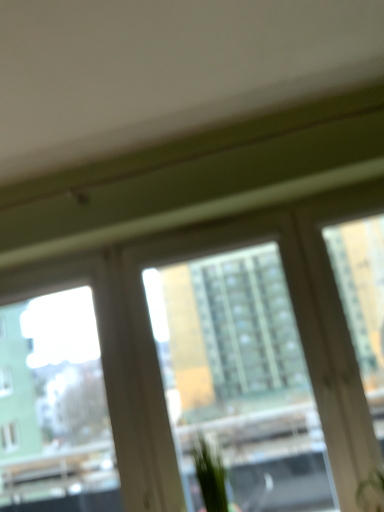
The width and height of the screenshot is (384, 512). I want to click on green leafy plant at center, the 2th plant when ordered from right to left, so click(210, 474).

Describe the element at coordinates (371, 492) in the screenshot. I see `green matte plant at lower right, placed as the first plant when sorted from right to left` at that location.

I want to click on green matte plant at lower right, arranged as the 2th plant when viewed from the left, so click(371, 492).

You are a GUI agent. You are given a task and a screenshot of the screen. Output one action in this format:
    pyautogui.click(x=<x>, y=<y>)
    Task: Click on the transparent glass window screen at left
    
    Given the screenshot: What is the action you would take?
    pyautogui.click(x=54, y=408)

The width and height of the screenshot is (384, 512). What are the coordinates of `green leafy plant at center, which is the 1th plant from left to right` in the screenshot? It's located at (210, 474).

Is transparent glass window at center positioned beyond the bounds of green leafy plant at center, the 2th plant when ordered from right to left?

Yes, transparent glass window at center is located beyond the bounds of green leafy plant at center, the 2th plant when ordered from right to left.

Which object is positioned more to the right, transparent glass window at center or green leafy plant at center, the 2th plant when ordered from right to left?

From the viewer's perspective, transparent glass window at center appears more on the right side.

From a real-world perspective, relative to green leafy plant at center, which is the 1th plant from left to right, is transparent glass window at center vertically above or below?

From a real-world perspective, transparent glass window at center is physically above green leafy plant at center, which is the 1th plant from left to right.

Looking at this image, from the image's perspective, who appears lower, transparent glass window at center or green leafy plant at center, which is the 1th plant from left to right?

green leafy plant at center, which is the 1th plant from left to right.

Who is taller, transparent glass window at center or transparent glass window screen at left?

transparent glass window at center.

Based on their positions, is transparent glass window at center located to the left or right of transparent glass window screen at left?

Based on their positions, transparent glass window at center is located to the right of transparent glass window screen at left.

Is transparent glass window at center not near transparent glass window screen at left?

No.

Measure the distance between transparent glass window at center and green matte plant at lower right, arranged as the 2th plant when viewed from the left.

A distance of 28.67 inches exists between transparent glass window at center and green matte plant at lower right, arranged as the 2th plant when viewed from the left.

Between point (164, 236) and point (383, 474), which one is positioned behind?

The point (164, 236) is more distant.

Based on the photo, is transparent glass window at center spatially inside green matte plant at lower right, placed as the first plant when sorted from right to left, or outside of it?

transparent glass window at center is not inside green matte plant at lower right, placed as the first plant when sorted from right to left, it's outside.

Is transparent glass window at center in contact with green matte plant at lower right, arranged as the 2th plant when viewed from the left?

transparent glass window at center and green matte plant at lower right, arranged as the 2th plant when viewed from the left, are clearly separated.

Is green leafy plant at center, which is the 1th plant from left to right, to the left or to the right of transparent glass window screen at left in the image?

In the image, green leafy plant at center, which is the 1th plant from left to right, appears on the right side of transparent glass window screen at left.

Is green leafy plant at center, which is the 1th plant from left to right, positioned far away from transparent glass window screen at left?

Actually, green leafy plant at center, which is the 1th plant from left to right, and transparent glass window screen at left are a little close together.

Is green leafy plant at center, which is the 1th plant from left to right, oriented towards transparent glass window screen at left?

No, green leafy plant at center, which is the 1th plant from left to right, does not turn towards transparent glass window screen at left.

Based on their sizes in the image, would you say green leafy plant at center, the 2th plant when ordered from right to left, is bigger or smaller than transparent glass window screen at left?

In the image, green leafy plant at center, the 2th plant when ordered from right to left, appears to be smaller than transparent glass window screen at left.

From a real-world perspective, between green matte plant at lower right, arranged as the 2th plant when viewed from the left, and green leafy plant at center, which is the 1th plant from left to right, who is vertically lower?

green matte plant at lower right, arranged as the 2th plant when viewed from the left.

Is green matte plant at lower right, arranged as the 2th plant when viewed from the left, next to green leafy plant at center, the 2th plant when ordered from right to left?

They are not placed beside each other.

Considering the relative positions of green matte plant at lower right, placed as the first plant when sorted from right to left, and green leafy plant at center, the 2th plant when ordered from right to left, in the image provided, is green matte plant at lower right, placed as the first plant when sorted from right to left, to the left or to the right of green leafy plant at center, the 2th plant when ordered from right to left,?

green matte plant at lower right, placed as the first plant when sorted from right to left, is positioned on green leafy plant at center, the 2th plant when ordered from right to left,'s right side.

In terms of height, does green matte plant at lower right, placed as the first plant when sorted from right to left, look taller or shorter compared to green leafy plant at center, the 2th plant when ordered from right to left?

green matte plant at lower right, placed as the first plant when sorted from right to left, is shorter than green leafy plant at center, the 2th plant when ordered from right to left.

The width and height of the screenshot is (384, 512). I want to click on window that appears on the right of green leafy plant at center, the 2th plant when ordered from right to left, so click(154, 346).

Does green leafy plant at center, the 2th plant when ordered from right to left, come in front of transparent glass window at center?

No, it is not.

From a real-world perspective, between green leafy plant at center, which is the 1th plant from left to right, and transparent glass window at center, who is vertically higher?

transparent glass window at center.

Considering the positions of points (211, 509) and (323, 345), is point (211, 509) farther from camera compared to point (323, 345)?

No, (211, 509) is closer to viewer.

Which point is more distant from viewer, (372,499) or (21,447)?

The point (21,447) is farther.

Which of these two, green matte plant at lower right, arranged as the 2th plant when viewed from the left, or transparent glass window screen at left, stands shorter?

Standing shorter between the two is green matte plant at lower right, arranged as the 2th plant when viewed from the left.

Would you say green matte plant at lower right, arranged as the 2th plant when viewed from the left, is to the left or to the right of transparent glass window screen at left in the picture?

In the image, green matte plant at lower right, arranged as the 2th plant when viewed from the left, appears on the right side of transparent glass window screen at left.

From a real-world perspective, is green matte plant at lower right, arranged as the 2th plant when viewed from the left, over transparent glass window screen at left?

No, from a real-world perspective, green matte plant at lower right, arranged as the 2th plant when viewed from the left, is not above transparent glass window screen at left.

At what (x,y) coordinates should I click in order to perform the action: click on plant located on the left of transparent glass window at center. Please return your answer as a coordinate pair (x, y). Image resolution: width=384 pixels, height=512 pixels. Looking at the image, I should click on (210, 474).

Locate an element on the screen. This screenshot has width=384, height=512. window that appears on the right of transparent glass window screen at left is located at coordinates (154, 346).

Looking at the image, which one is located further to transparent glass window screen at left, green leafy plant at center, which is the 1th plant from left to right, or transparent glass window at center?

green leafy plant at center, which is the 1th plant from left to right, is further to transparent glass window screen at left.

Which object lies nearer to the anchor point green leafy plant at center, which is the 1th plant from left to right, transparent glass window at center or transparent glass window screen at left?

Among the two, transparent glass window at center is located nearer to green leafy plant at center, which is the 1th plant from left to right.

Estimate the real-world distances between objects in this image. Which object is further from transparent glass window screen at left, green matte plant at lower right, arranged as the 2th plant when viewed from the left, or transparent glass window at center?

Among the two, green matte plant at lower right, arranged as the 2th plant when viewed from the left, is located further to transparent glass window screen at left.

From the image, which object appears to be nearer to transparent glass window at center, transparent glass window screen at left or green leafy plant at center, the 2th plant when ordered from right to left?

Based on the image, transparent glass window screen at left appears to be nearer to transparent glass window at center.

Which object lies further to the anchor point green leafy plant at center, the 2th plant when ordered from right to left, transparent glass window screen at left or transparent glass window at center?

transparent glass window screen at left is positioned further to the anchor green leafy plant at center, the 2th plant when ordered from right to left.

Estimate the real-world distances between objects in this image. Which object is closer to transparent glass window screen at left, green leafy plant at center, which is the 1th plant from left to right, or green matte plant at lower right, placed as the first plant when sorted from right to left?

Among the two, green leafy plant at center, which is the 1th plant from left to right, is located nearer to transparent glass window screen at left.

Looking at this image, from the image, which object appears to be nearer to transparent glass window at center, transparent glass window screen at left or green matte plant at lower right, arranged as the 2th plant when viewed from the left?

Among the two, transparent glass window screen at left is located nearer to transparent glass window at center.

Which object lies nearer to the anchor point green matte plant at lower right, placed as the first plant when sorted from right to left, green leafy plant at center, the 2th plant when ordered from right to left, or transparent glass window screen at left?

green leafy plant at center, the 2th plant when ordered from right to left, is positioned closer to the anchor green matte plant at lower right, placed as the first plant when sorted from right to left.

The height and width of the screenshot is (512, 384). Identify the location of window located between transparent glass window screen at left and green matte plant at lower right, placed as the first plant when sorted from right to left, in the left-right direction. (154, 346).

Where is `plant situated between transparent glass window screen at left and transparent glass window at center from left to right`? plant situated between transparent glass window screen at left and transparent glass window at center from left to right is located at coordinates (210, 474).

Image resolution: width=384 pixels, height=512 pixels. What are the coordinates of `window between green leafy plant at center, which is the 1th plant from left to right, and green matte plant at lower right, arranged as the 2th plant when viewed from the left, from left to right` in the screenshot? It's located at (154, 346).

This screenshot has width=384, height=512. Identify the location of plant between transparent glass window screen at left and green matte plant at lower right, arranged as the 2th plant when viewed from the left. (210, 474).